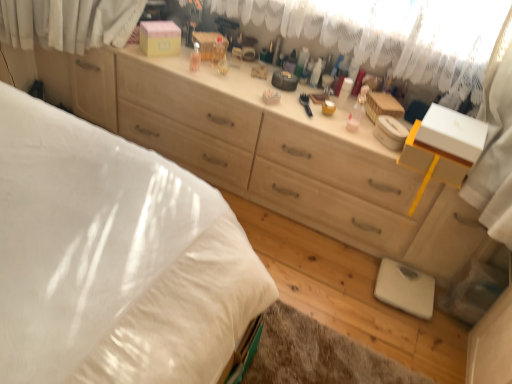
What is the approximate width of transparent plastic bottle at center, arranged as the 3th toiletry when viewed from the right?

transparent plastic bottle at center, arranged as the 3th toiletry when viewed from the right, is 2.33 inches in width.

How much space does matte plastic container at center, placed as the first toiletry when sorted from right to left, occupy horizontally?

2.11 inches.

The height and width of the screenshot is (384, 512). What do you see at coordinates (345, 91) in the screenshot?
I see `matte plastic container at center, placed as the first toiletry when sorted from right to left` at bounding box center [345, 91].

Find the location of `white soft bed at lower left`. white soft bed at lower left is located at coordinates (113, 258).

Measure the distance between point [448,23] and camera.

A distance of 1.76 meters exists between point [448,23] and camera.

The width and height of the screenshot is (512, 384). Find the location of `transparent plastic bottle at center, arranged as the 3th toiletry when viewed from the right`. transparent plastic bottle at center, arranged as the 3th toiletry when viewed from the right is located at coordinates (195, 58).

Which object is more forward, white lace curtain at upper center or white plastic container at center, placed as the 2th toiletry when sorted from left to right?

white lace curtain at upper center is in front.

Is white lace curtain at upper center facing away from white plastic container at center, arranged as the 2th toiletry when viewed from the right?

That's right, white lace curtain at upper center is facing away from white plastic container at center, arranged as the 2th toiletry when viewed from the right.

From the image's perspective, is white lace curtain at upper center positioned above or below white plastic container at center, placed as the 2th toiletry when sorted from left to right?

From the image's perspective, white lace curtain at upper center appears above white plastic container at center, placed as the 2th toiletry when sorted from left to right.

Does point (68, 349) appear closer or farther from the camera than point (315, 85)?

Point (68, 349) appears to be closer to the viewer than point (315, 85).

From a real-world perspective, starting from the white soft bed at lower left, which toiletry is the 3rd one below it? Please provide its 2D coordinates.

[(316, 73)]

From a real-world perspective, is white soft bed at lower left physically located above or below white plastic container at center, arranged as the 2th toiletry when viewed from the right?

From a real-world perspective, white soft bed at lower left is physically above white plastic container at center, arranged as the 2th toiletry when viewed from the right.

From a real-world perspective, which is physically above, white lace curtain at upper center or white soft bed at lower left?

white lace curtain at upper center, from a real-world perspective.

Is white lace curtain at upper center oriented away from white soft bed at lower left?

No, white lace curtain at upper center's orientation is not away from white soft bed at lower left.

Is white lace curtain at upper center at the left side of white soft bed at lower left?

No.

Considering the positions of objects white plastic container at center, placed as the 2th toiletry when sorted from left to right, and white lace curtain at upper center in the image provided, who is behind, white plastic container at center, placed as the 2th toiletry when sorted from left to right, or white lace curtain at upper center?

Positioned behind is white plastic container at center, placed as the 2th toiletry when sorted from left to right.

Measure the distance between white plastic container at center, placed as the 2th toiletry when sorted from left to right, and white lace curtain at upper center.

white plastic container at center, placed as the 2th toiletry when sorted from left to right, and white lace curtain at upper center are 15.88 inches apart from each other.

Is white plastic container at center, placed as the 2th toiletry when sorted from left to right, outside of white lace curtain at upper center?

No, white plastic container at center, placed as the 2th toiletry when sorted from left to right, is inside white lace curtain at upper center's boundary.

Between matte plastic container at center, placed as the first toiletry when sorted from right to left, and white lace curtain at upper center, which one has less height?

Result: matte plastic container at center, placed as the first toiletry when sorted from right to left.

In the image, is matte plastic container at center, placed as the first toiletry when sorted from right to left, on the left side or the right side of white lace curtain at upper center?

In the image, matte plastic container at center, placed as the first toiletry when sorted from right to left, appears on the right side of white lace curtain at upper center.

Which is correct: matte plastic container at center, the 3th toiletry when ordered from left to right, is inside white lace curtain at upper center, or outside of it?

matte plastic container at center, the 3th toiletry when ordered from left to right, cannot be found inside white lace curtain at upper center.

How much distance is there between matte plastic container at center, placed as the first toiletry when sorted from right to left, and white lace curtain at upper center?

matte plastic container at center, placed as the first toiletry when sorted from right to left, and white lace curtain at upper center are 14.88 inches apart.

Considering the positions of objects white plastic container at center, arranged as the 2th toiletry when viewed from the right, and white soft bed at lower left in the image provided, who is more to the right, white plastic container at center, arranged as the 2th toiletry when viewed from the right, or white soft bed at lower left?

Positioned to the right is white plastic container at center, arranged as the 2th toiletry when viewed from the right.

Could white soft bed at lower left be considered to be inside white plastic container at center, arranged as the 2th toiletry when viewed from the right?

No, white soft bed at lower left is located outside of white plastic container at center, arranged as the 2th toiletry when viewed from the right.

Locate an element on the screen. bed above the white plastic container at center, placed as the 2th toiletry when sorted from left to right (from a real-world perspective) is located at coordinates (113, 258).

Is white plastic container at center, arranged as the 2th toiletry when viewed from the right, not near white soft bed at lower left?

Yes, white plastic container at center, arranged as the 2th toiletry when viewed from the right, and white soft bed at lower left are quite far apart.

Which of these two, white plastic container at center, arranged as the 2th toiletry when viewed from the right, or matte plastic container at center, placed as the first toiletry when sorted from right to left, stands taller?

Standing taller between the two is white plastic container at center, arranged as the 2th toiletry when viewed from the right.

Is white plastic container at center, arranged as the 2th toiletry when viewed from the right, surrounding matte plastic container at center, the 3th toiletry when ordered from left to right?

No.

Is white plastic container at center, placed as the 2th toiletry when sorted from left to right, next to matte plastic container at center, placed as the first toiletry when sorted from right to left?

They are not placed beside each other.

From the image's perspective, count 2nd toiletrys downward from the white lace curtain at upper center and point to it. Please provide its 2D coordinates.

[(316, 73)]

From the image's perspective, count 2nd toiletrys upward from the white soft bed at lower left and point to it. Please provide its 2D coordinates.

[(316, 73)]

Which object lies further to the anchor point white soft bed at lower left, white plastic container at center, placed as the 2th toiletry when sorted from left to right, or white lace curtain at upper center?

The object further to white soft bed at lower left is white plastic container at center, placed as the 2th toiletry when sorted from left to right.

Estimate the real-world distances between objects in this image. Which object is further from white soft bed at lower left, white lace curtain at upper center or white plastic container at center, placed as the 2th toiletry when sorted from left to right?

The object further to white soft bed at lower left is white plastic container at center, placed as the 2th toiletry when sorted from left to right.

Which object lies further to the anchor point matte plastic container at center, placed as the first toiletry when sorted from right to left, white lace curtain at upper center or transparent plastic bottle at center, arranged as the 3th toiletry when viewed from the right?

transparent plastic bottle at center, arranged as the 3th toiletry when viewed from the right.

From the image, which object appears to be farther from white plastic container at center, arranged as the 2th toiletry when viewed from the right, transparent plastic bottle at center, arranged as the 3th toiletry when viewed from the right, or white soft bed at lower left?

white soft bed at lower left.

Which object lies nearer to the anchor point transparent plastic bottle at center, which is counted as the 1th toiletry, starting from the left, white soft bed at lower left or white plastic container at center, arranged as the 2th toiletry when viewed from the right?

white plastic container at center, arranged as the 2th toiletry when viewed from the right, lies closer to transparent plastic bottle at center, which is counted as the 1th toiletry, starting from the left, than the other object.

Considering their positions, is white lace curtain at upper center positioned closer to transparent plastic bottle at center, arranged as the 3th toiletry when viewed from the right, than matte plastic container at center, the 3th toiletry when ordered from left to right?

Among the two, matte plastic container at center, the 3th toiletry when ordered from left to right, is located nearer to transparent plastic bottle at center, arranged as the 3th toiletry when viewed from the right.

Looking at the image, which one is located closer to matte plastic container at center, the 3th toiletry when ordered from left to right, transparent plastic bottle at center, which is counted as the 1th toiletry, starting from the left, or white soft bed at lower left?

transparent plastic bottle at center, which is counted as the 1th toiletry, starting from the left.

Based on their spatial positions, is white soft bed at lower left or white lace curtain at upper center closer to matte plastic container at center, placed as the first toiletry when sorted from right to left?

The object closer to matte plastic container at center, placed as the first toiletry when sorted from right to left, is white lace curtain at upper center.

Find the location of a particular element. This screenshot has width=512, height=384. curtain between transparent plastic bottle at center, which is counted as the 1th toiletry, starting from the left, and white plastic container at center, arranged as the 2th toiletry when viewed from the right, in the horizontal direction is located at coordinates (392, 34).

You are a GUI agent. You are given a task and a screenshot of the screen. Output one action in this format:
    pyautogui.click(x=<x>, y=<y>)
    Task: Click on the toiletry between white soft bed at lower left and transparent plastic bottle at center, arranged as the 3th toiletry when viewed from the right, from front to back
    This screenshot has height=384, width=512.
    Given the screenshot: What is the action you would take?
    pyautogui.click(x=345, y=91)

This screenshot has width=512, height=384. In order to click on toiletry between transparent plastic bottle at center, arranged as the 3th toiletry when viewed from the right, and matte plastic container at center, placed as the first toiletry when sorted from right to left in this screenshot , I will do `click(316, 73)`.

Find the location of `curtain between transparent plastic bottle at center, which is counted as the 1th toiletry, starting from the left, and matte plastic container at center, placed as the first toiletry when sorted from right to left`. curtain between transparent plastic bottle at center, which is counted as the 1th toiletry, starting from the left, and matte plastic container at center, placed as the first toiletry when sorted from right to left is located at coordinates (392, 34).